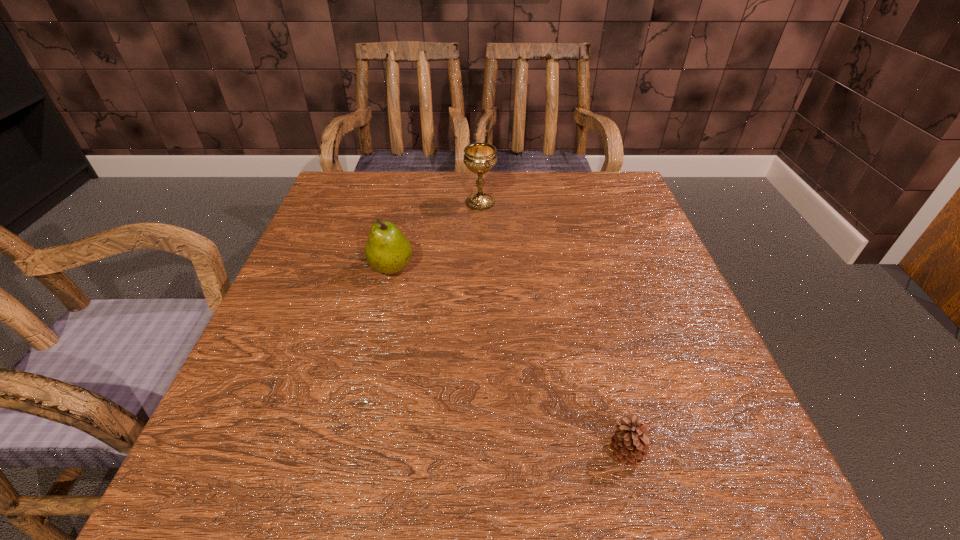
Find the location of `vacant space that is in between the pear and the farthest object`. vacant space that is in between the pear and the farthest object is located at coordinates (436, 235).

Identify which object is the second closest to the farthest object. Please provide its 2D coordinates. Your answer should be formatted as a tuple, i.e. [(x, y)], where the tuple contains the x and y coordinates of a point satisfying the conditions above.

[(630, 445)]

Locate an element on the screen. object that is the closest to the shortest object is located at coordinates (387, 250).

I want to click on vacant space that satisfies the following two spatial constraints: 1. on the back side of the leftmost object; 2. on the left side of the chalice, so click(x=406, y=203).

You are a GUI agent. You are given a task and a screenshot of the screen. Output one action in this format:
    pyautogui.click(x=<x>, y=<y>)
    Task: Click on the free spot that satisfies the following two spatial constraints: 1. on the back side of the leftmost object; 2. on the left side of the second object from right to left
    The height and width of the screenshot is (540, 960).
    Given the screenshot: What is the action you would take?
    pyautogui.click(x=406, y=203)

Locate an element on the screen. The height and width of the screenshot is (540, 960). vacant space that satisfies the following two spatial constraints: 1. on the back side of the leftmost object; 2. on the right side of the second object from right to left is located at coordinates (406, 203).

You are a GUI agent. You are given a task and a screenshot of the screen. Output one action in this format:
    pyautogui.click(x=<x>, y=<y>)
    Task: Click on the free space in the image that satisfies the following two spatial constraints: 1. on the front side of the rightmost object; 2. on the left side of the second nearest object
    
    Given the screenshot: What is the action you would take?
    pyautogui.click(x=349, y=453)

Find the location of `free point that satisfies the following two spatial constraints: 1. on the front side of the second nearest object; 2. on the right side of the pinecone`. free point that satisfies the following two spatial constraints: 1. on the front side of the second nearest object; 2. on the right side of the pinecone is located at coordinates (349, 453).